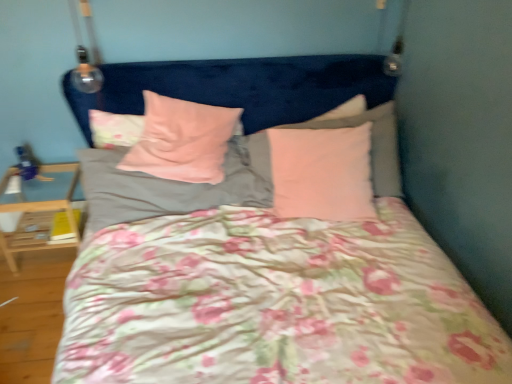
Question: From the image's perspective, is floral fabric pillow at upper left, placed as the fifth pillow when sorted from right to left, above or below light wood/wooden table at lower left?

Choices:
 (A) above
 (B) below

Answer: (A)

Question: Choose the correct answer: Is floral fabric pillow at upper left, the first pillow when ordered from left to right, inside light wood/wooden table at lower left or outside it?

Choices:
 (A) inside
 (B) outside

Answer: (B)

Question: Which is farther from the pink matte pillow at upper right, which ranks as the fourth pillow in left-to-right order?

Choices:
 (A) light wood/wooden table at lower left
 (B) floral fabric pillow at upper left, the first pillow when ordered from left to right
 (C) pink fabric pillow at center, the fifth pillow viewed from the left
 (D) pink velvety pillow at center, the third pillow when ordered from right to left
 (E) pink soft fabric pillow at center, the fourth pillow when ordered from right to left

Answer: (A)

Question: Which object is positioned farthest from the floral fabric pillow at upper left, the first pillow when ordered from left to right?

Choices:
 (A) pink soft fabric pillow at center, positioned as the 2th pillow in left-to-right order
 (B) pink fabric pillow at center, the 1th pillow from the right
 (C) light wood/wooden table at lower left
 (D) pink matte pillow at upper right, which is the second pillow in right-to-left order
 (E) pink velvety pillow at center, the third pillow when ordered from right to left

Answer: (D)